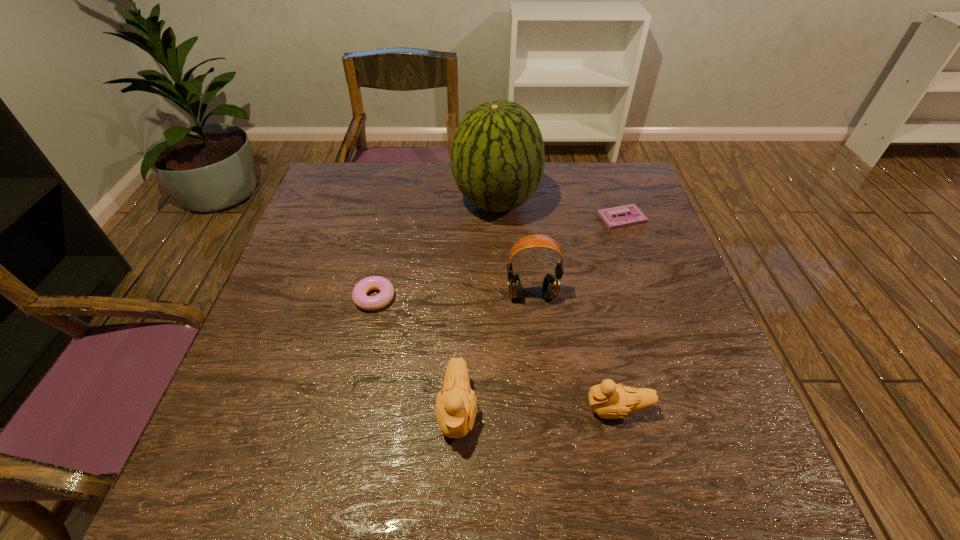
Where is `vacant space situated on the face of the second object from right to left`? Image resolution: width=960 pixels, height=540 pixels. vacant space situated on the face of the second object from right to left is located at coordinates (516, 409).

What are the coordinates of `free location located on the face of the second object from right to left` in the screenshot? It's located at (457, 409).

This screenshot has height=540, width=960. What are the coordinates of `free region located on the face of the second object from right to left` in the screenshot? It's located at (415, 409).

Where is `blank space located 0.160m on the left of the tallest object`? The height and width of the screenshot is (540, 960). blank space located 0.160m on the left of the tallest object is located at coordinates (398, 202).

In order to click on blank space located on the front of the rightmost object in this screenshot , I will do `click(661, 330)`.

This screenshot has width=960, height=540. Identify the location of vacant space located on the front of the leftmost object. (350, 407).

Where is `free space located on the ear cups of the second tallest object`? free space located on the ear cups of the second tallest object is located at coordinates (544, 409).

Find the location of `watermelon positioned at the far edge`. watermelon positioned at the far edge is located at coordinates (497, 155).

Identify the location of videotape at the far edge. This screenshot has width=960, height=540. (634, 216).

You are a GUI agent. You are given a task and a screenshot of the screen. Output one action in this format:
    pyautogui.click(x=<x>, y=<y>)
    Task: Click on the object that is at the right edge
    The image size is (960, 540).
    Given the screenshot: What is the action you would take?
    pyautogui.click(x=634, y=216)